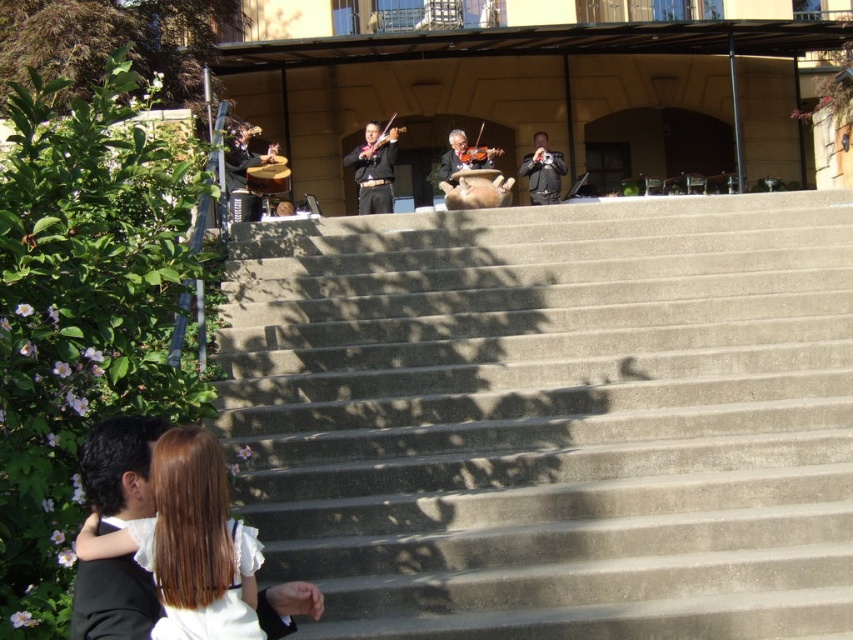
Question: Does black leather jacket at upper center appear under matte black violin at center?

Choices:
 (A) no
 (B) yes

Answer: (B)

Question: Estimate the real-world distances between objects in this image. Which object is closer to the matte black drum at left?

Choices:
 (A) black satin suit at center
 (B) smooth white blouse at lower left
 (C) shiny brown violin at center
 (D) matte black violin at center

Answer: (A)

Question: Which is nearer to the black satin suit at center?

Choices:
 (A) concrete stairs at lower left
 (B) shiny brown violin at center
 (C) smooth white blouse at lower left
 (D) black leather jacket at upper center

Answer: (B)

Question: Can you confirm if shiny brown violin at center is thinner than matte black violin at center?

Choices:
 (A) no
 (B) yes

Answer: (A)

Question: Which object is positioned closest to the black satin suit at center?

Choices:
 (A) shiny brown violin at center
 (B) matte black violin at center
 (C) concrete stairs at lower left

Answer: (B)

Question: Can you confirm if concrete stairs at lower left is thinner than matte black violin at center?

Choices:
 (A) yes
 (B) no

Answer: (B)